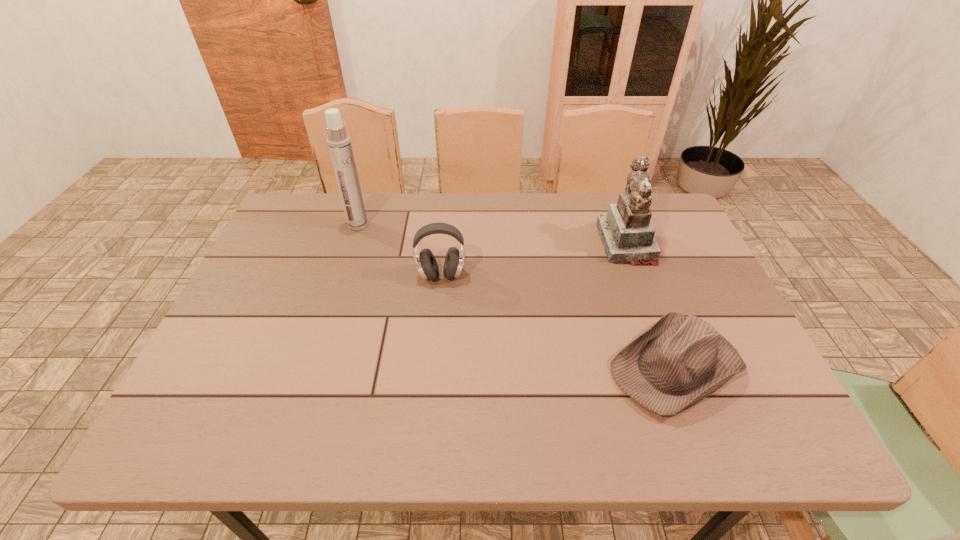
What are the coordinates of `free space between the shortest object and the third object from right to left` in the screenshot? It's located at (559, 321).

You are a GUI agent. You are given a task and a screenshot of the screen. Output one action in this format:
    pyautogui.click(x=<x>, y=<y>)
    Task: Click on the vacant region between the third shortest object and the tallest object
    Image resolution: width=960 pixels, height=540 pixels.
    Given the screenshot: What is the action you would take?
    pyautogui.click(x=492, y=234)

Identify the location of blank region between the tallest object and the figurine. (492, 234).

Find the location of `free space between the leftmost object and the fedora`. free space between the leftmost object and the fedora is located at coordinates (516, 295).

Where is `free point between the second object from left to right and the aerosol can`? Image resolution: width=960 pixels, height=540 pixels. free point between the second object from left to right and the aerosol can is located at coordinates (399, 250).

Identify the location of vacant space that's between the fedora and the second object from left to right. (559, 321).

You are a GUI agent. You are given a task and a screenshot of the screen. Output one action in this format:
    pyautogui.click(x=<x>, y=<y>)
    Task: Click on the unoccupied area between the aerosol can and the third object from right to left
    Image resolution: width=960 pixels, height=540 pixels.
    Given the screenshot: What is the action you would take?
    pyautogui.click(x=399, y=250)

Identify which object is the closest to the aerosol can. Please provide its 2D coordinates. Your answer should be formatted as a tuple, i.e. [(x, y)], where the tuple contains the x and y coordinates of a point satisfying the conditions above.

[(426, 263)]

Find the location of a particular element. the closest object to the leftmost object is located at coordinates (426, 263).

At what (x,y) coordinates should I click in order to perform the action: click on vacant space that satisfies the following two spatial constraints: 1. on the front-facing side of the nearest object; 2. on the left side of the figurine. Please return your answer as a coordinate pair (x, y). This screenshot has width=960, height=540. Looking at the image, I should click on (672, 366).